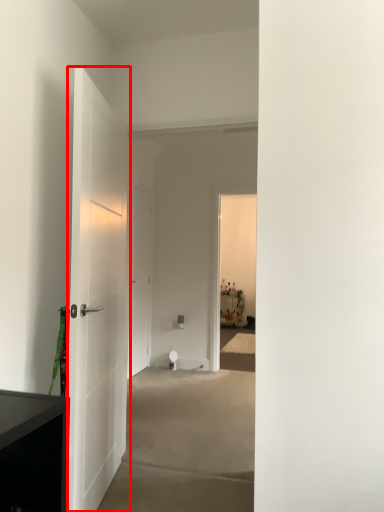
Question: From the image's perspective, where is door (annotated by the red box) located relative to door?

Choices:
 (A) below
 (B) above

Answer: (B)